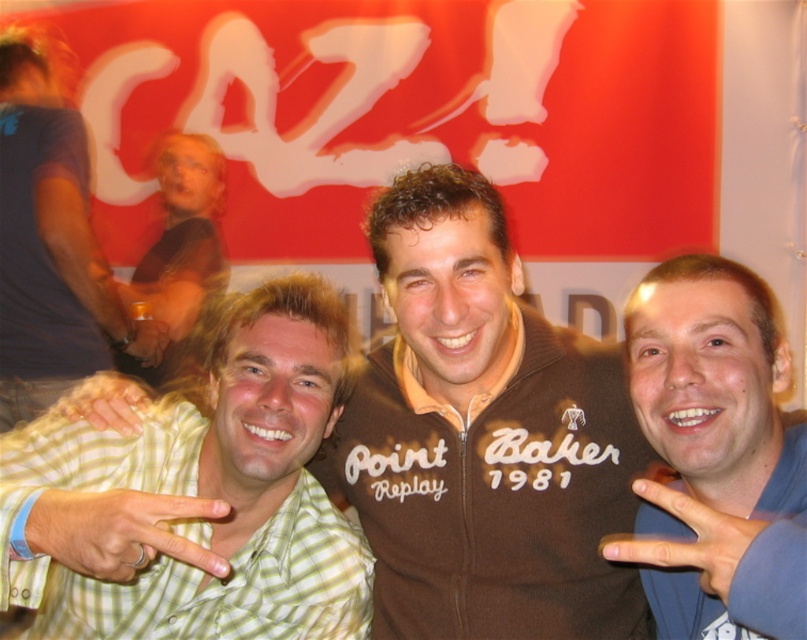
Question: Which of the following is the closest to the observer?

Choices:
 (A) (132, 406)
 (B) (63, 208)
 (C) (70, 516)

Answer: (C)

Question: Considering the relative positions of blue cotton shirt at right and smooth skin hand at lower right in the image provided, where is blue cotton shirt at right located with respect to smooth skin hand at lower right?

Choices:
 (A) above
 (B) below

Answer: (A)

Question: Among these points, which one is farthest from the camera?

Choices:
 (A) (31, 124)
 (B) (776, 442)

Answer: (A)

Question: Which is farther from the green checkered shirt at lower left?

Choices:
 (A) light brown hair at left
 (B) matte plastic cup at upper left
 (C) green checkered shirt at center
 (D) smooth skin hand at lower right

Answer: (B)

Question: Is blue cotton shirt at right bigger than green checkered shirt at lower left?

Choices:
 (A) yes
 (B) no

Answer: (A)

Question: Is smooth skin hand at lower right to the left of matte plastic cup at upper left from the viewer's perspective?

Choices:
 (A) no
 (B) yes

Answer: (A)